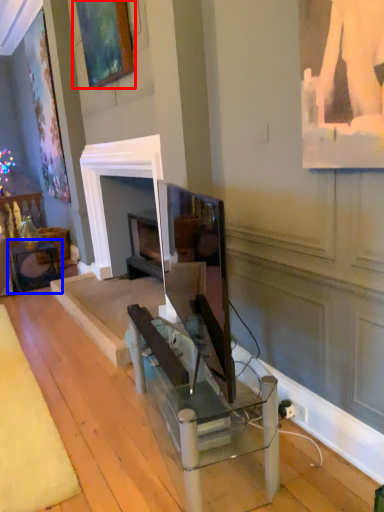
Question: Which of the following is the closest to the observer, picture frame (highlighted by a red box) or table (highlighted by a blue box)?

Choices:
 (A) picture frame
 (B) table

Answer: (A)